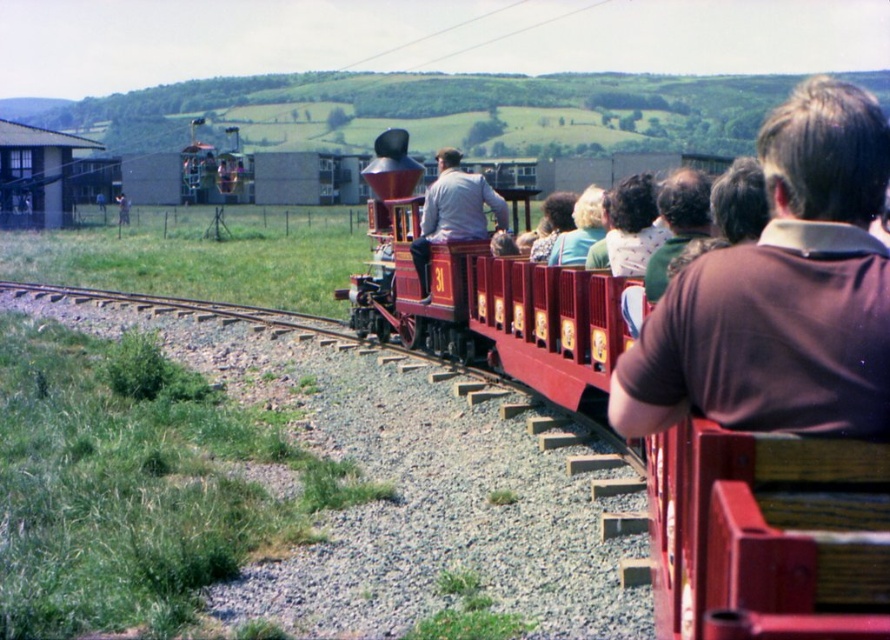
You are a photographer trying to capture a clear photo of both the light gray fabric jacket at center and the blonde hair at center. Since you want to ensure both are in focus, which object should you adjust your camera focus on first, the one closer to you or the one farther away?

The light gray fabric jacket at center is closer to you than the blonde hair at center. Therefore, you should focus on the light gray fabric jacket at center first to ensure both are in focus.

You are standing on the wooden bench at center and want to hand a jacket to the person wearing the light gray fabric jacket at center. In which direction should you move to reach them?

The wooden bench at center is to the right of the light gray fabric jacket at center, so you should move to your left to reach the person wearing the light gray fabric jacket at center.